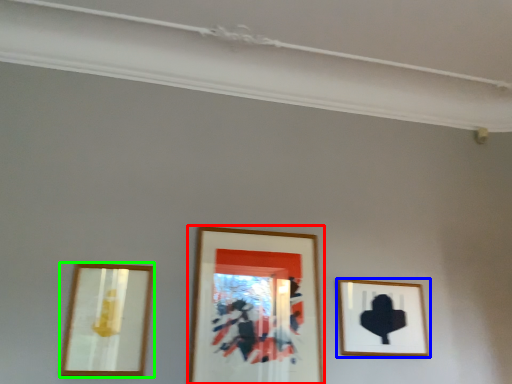
Question: Which object is positioned farthest from picture frame (highlighted by a red box)? Select from picture frame (highlighted by a blue box) and picture frame (highlighted by a green box).

Choices:
 (A) picture frame
 (B) picture frame

Answer: (B)